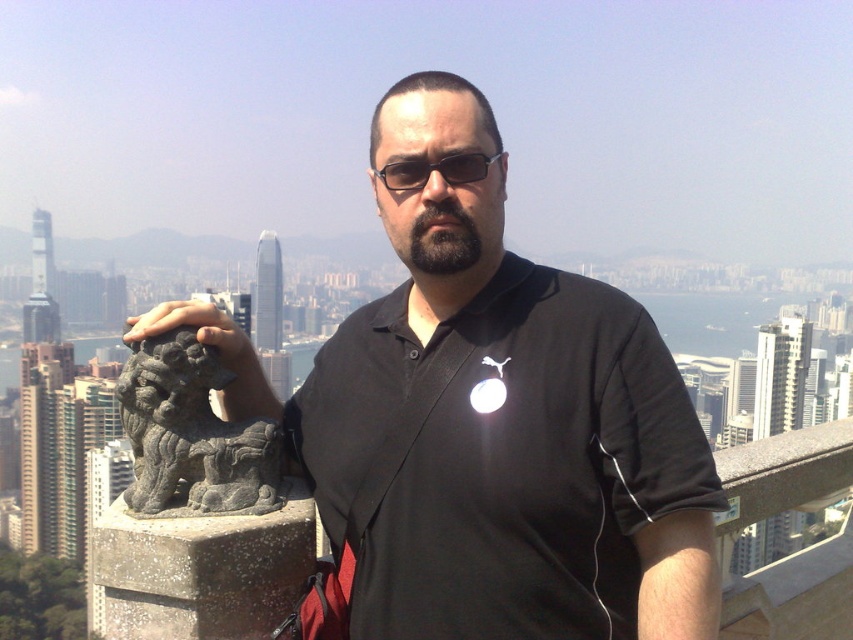
You are a photographer trying to capture the city skyline in the background. The person in the image is wearing a black matte shirt at center and sunglasses at center. Which item is closer to the left side of the frame?

The black matte shirt at center is positioned on the left side of the sunglasses at center, so the black matte shirt at center is closer to the left side of the frame.

You are a tourist in the city and want to take a photo of the gray stone lion at left. Where should you stand to get the best view?

The gray stone lion at left is located at coordinates point (x=192, y=435), so you should position yourself facing that coordinate point to capture the best view of the gray stone lion at left.

You are a photographer trying to capture the city skyline in the background. You notice the gray stone lion at left and the sunglasses at center. Which object should you focus on first if you want to ensure both are in the frame without moving the camera?

The gray stone lion at left is larger in size than sunglasses at center, so focusing on the larger gray stone lion at left first will help ensure both objects remain in the frame.